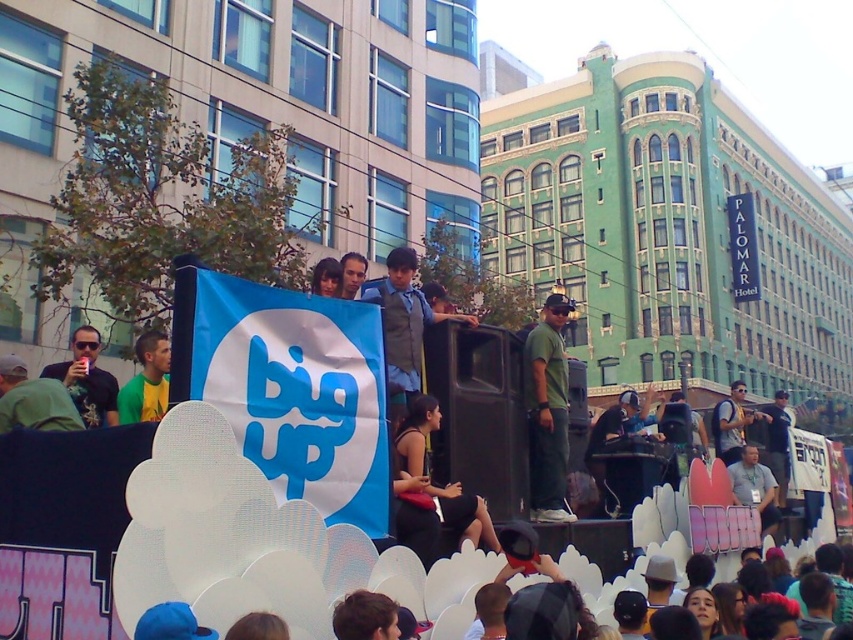
Question: Can you confirm if matte black sunglasses at left is positioned below light blue fabric banner at center?

Choices:
 (A) no
 (B) yes

Answer: (A)

Question: Observing the image, what is the correct spatial positioning of green matte t-shirt at center in reference to light brown leather jacket at center?

Choices:
 (A) left
 (B) right

Answer: (B)

Question: Is dark blue jeans at center thinner than smooth skin face at center?

Choices:
 (A) no
 (B) yes

Answer: (A)

Question: Among these objects, which one is farthest from the camera?

Choices:
 (A) light blue fabric banner at center
 (B) matte black sunglasses at left
 (C) smooth skin face at center

Answer: (A)

Question: Which object is closer to the camera taking this photo?

Choices:
 (A) matte black shirt at center
 (B) green fabric shirt at left
 (C) matte black sunglasses at left

Answer: (B)

Question: Which object appears farthest from the camera in this image?

Choices:
 (A) light brown leather jacket at center
 (B) green fabric shirt at left

Answer: (A)